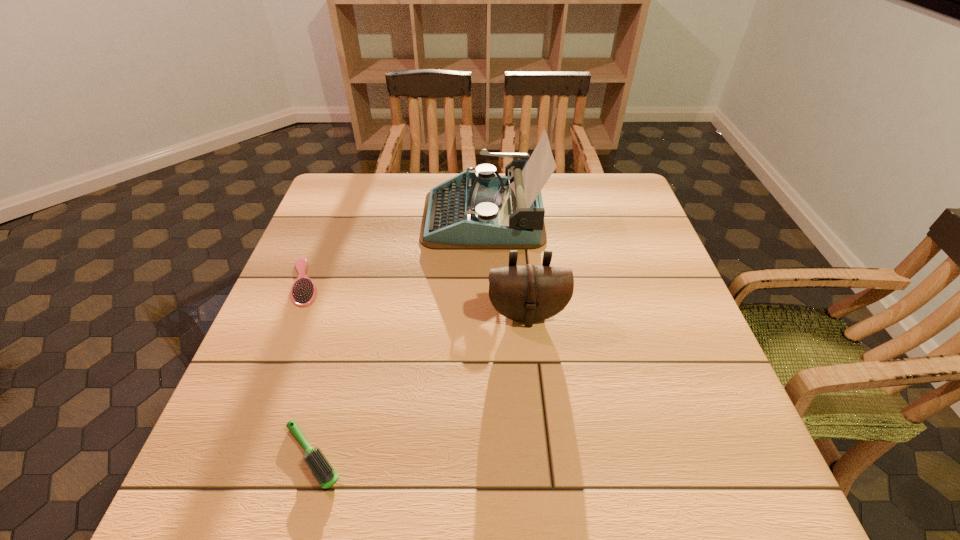
You are a GUI agent. You are given a task and a screenshot of the screen. Output one action in this format:
    pyautogui.click(x=<x>, y=<y>)
    Task: Click on the vacant space located 0.310m with the flap open on the second tallest object
    The image size is (960, 540).
    Given the screenshot: What is the action you would take?
    pyautogui.click(x=543, y=474)

Find the location of a particular element. The width and height of the screenshot is (960, 540). blank space located on the back of the taller hairbrush is located at coordinates (337, 367).

In order to click on free region located on the back of the shorter hairbrush in this screenshot , I will do `click(342, 190)`.

Identify the location of object that is at the far edge. (482, 210).

Locate an element on the screen. This screenshot has height=540, width=960. object at the near edge is located at coordinates (326, 476).

This screenshot has height=540, width=960. I want to click on object that is positioned at the near left corner, so click(x=326, y=476).

Where is `vacant space at the far edge`? The height and width of the screenshot is (540, 960). vacant space at the far edge is located at coordinates (394, 187).

Image resolution: width=960 pixels, height=540 pixels. Identify the location of vacant space at the near edge of the desktop. (428, 469).

At what (x,y) coordinates should I click in order to perform the action: click on vacant area at the left edge. Please return your answer as a coordinate pair (x, y). Looking at the image, I should click on (348, 242).

Where is `vacant space at the right edge of the desktop`? vacant space at the right edge of the desktop is located at coordinates (666, 281).